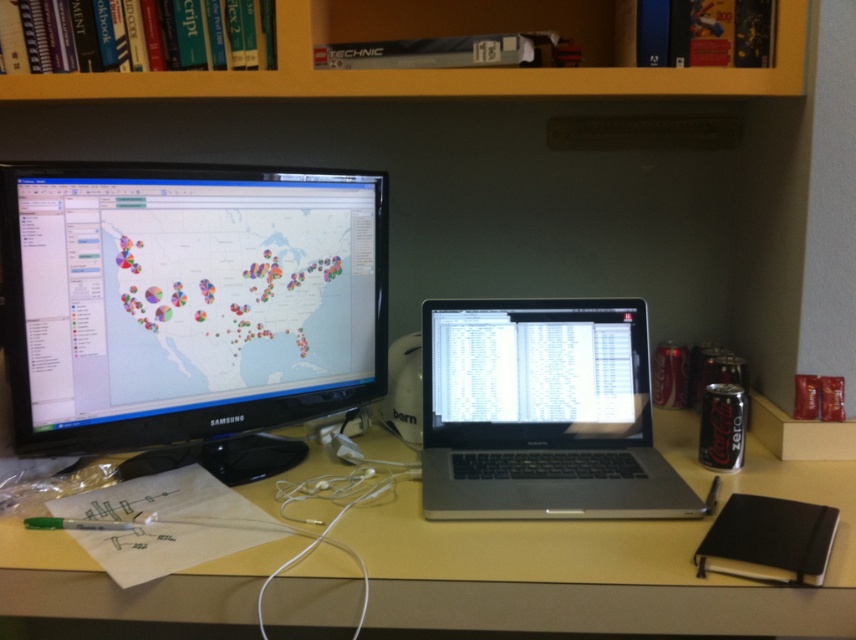
Does sleek silver laptop at center appear over yellow wood bookshelf at upper center?

No, sleek silver laptop at center is not above yellow wood bookshelf at upper center.

Which is in front, point (510, 381) or point (321, 80)?

Point (321, 80)

I want to click on sleek silver laptop at center, so click(x=542, y=412).

Can you confirm if black glossy monitor at left is wider than sleek silver laptop at center?

Yes, black glossy monitor at left is wider than sleek silver laptop at center.

Is point (52, 340) closer to viewer compared to point (658, 500)?

Yes, point (52, 340) is in front of point (658, 500).

Which is behind, point (223, 467) or point (480, 374)?

Positioned behind is point (480, 374).

This screenshot has width=856, height=640. I want to click on black glossy monitor at left, so click(x=189, y=307).

Does yellow matte table at center have a lesser height compared to sleek silver laptop at center?

Yes.

Who is more distant from viewer, (627, 630) or (512, 340)?

The point (512, 340) is more distant.

At what (x,y) coordinates should I click in order to perform the action: click on yellow matte table at center. Please return your answer as a coordinate pair (x, y). Looking at the image, I should click on (598, 566).